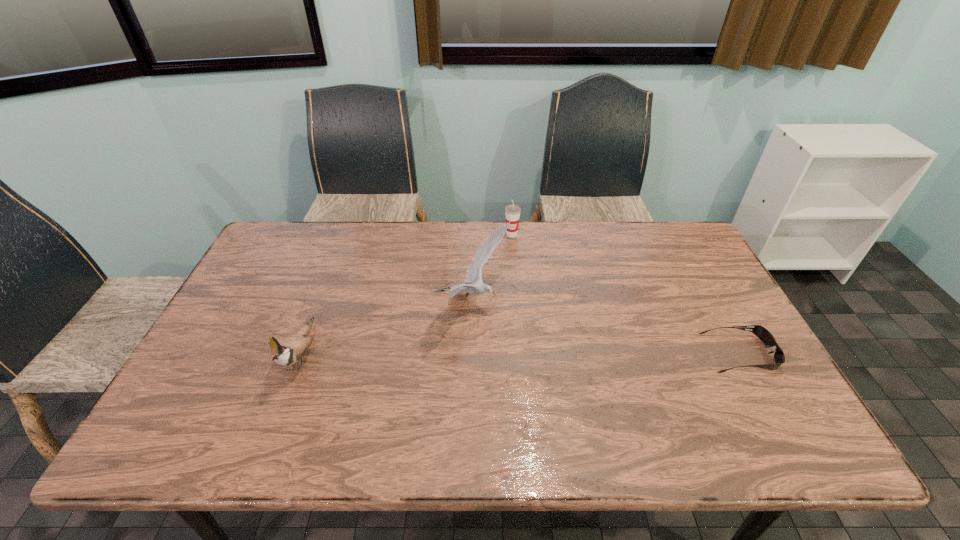
Where is `vacant space in between the cup and the gull`? The image size is (960, 540). vacant space in between the cup and the gull is located at coordinates (492, 269).

Find the location of `free spot between the sunglasses and the gull`. free spot between the sunglasses and the gull is located at coordinates (607, 329).

In order to click on the third closest object to the farthest object in this screenshot , I will do `click(288, 350)`.

Locate an element on the screen. Image resolution: width=960 pixels, height=540 pixels. the closest object to the leftmost object is located at coordinates (474, 272).

In order to click on vacant space that satisfies the following two spatial constraints: 1. on the back side of the gull; 2. on the right side of the second shortest object in this screenshot , I will do `click(474, 234)`.